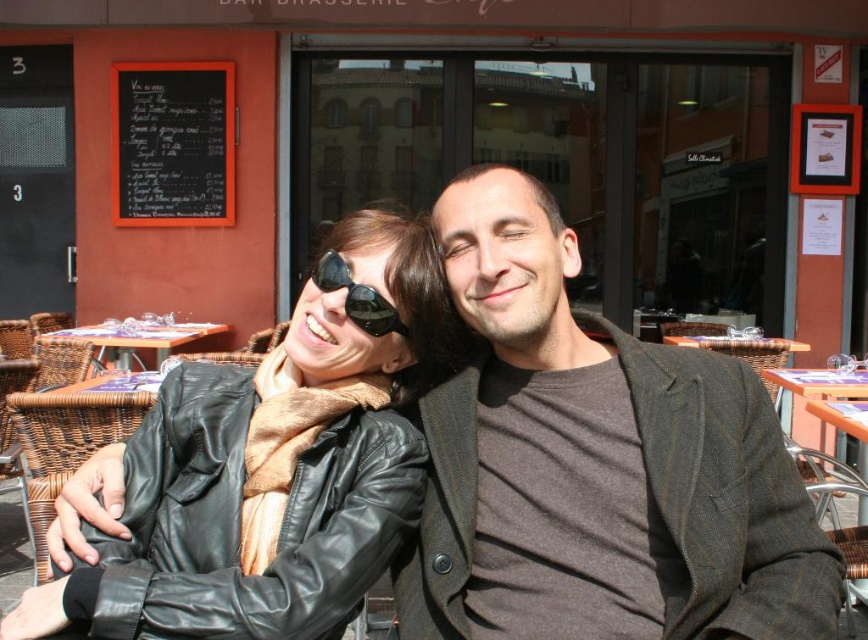
Question: Among these points, which one is nearest to the camera?

Choices:
 (A) (214, 221)
 (B) (360, 326)
 (C) (517, 227)

Answer: (C)

Question: Does brown pinstripe blazer at center have a greater width compared to black leather jacket at center?

Choices:
 (A) yes
 (B) no

Answer: (A)

Question: Can you confirm if black leather jacket at center is positioned to the right of black chalkboard at upper left?

Choices:
 (A) no
 (B) yes

Answer: (B)

Question: Can you confirm if black chalkboard at upper left is smaller than wooden table at center?

Choices:
 (A) yes
 (B) no

Answer: (A)

Question: Which of the following is the closest to the observer?

Choices:
 (A) black chalkboard at upper left
 (B) brown pinstripe blazer at center
 (C) black leather jacket at center

Answer: (C)

Question: Which object is farther from the camera taking this photo?

Choices:
 (A) wooden table at center
 (B) brown pinstripe blazer at center

Answer: (A)